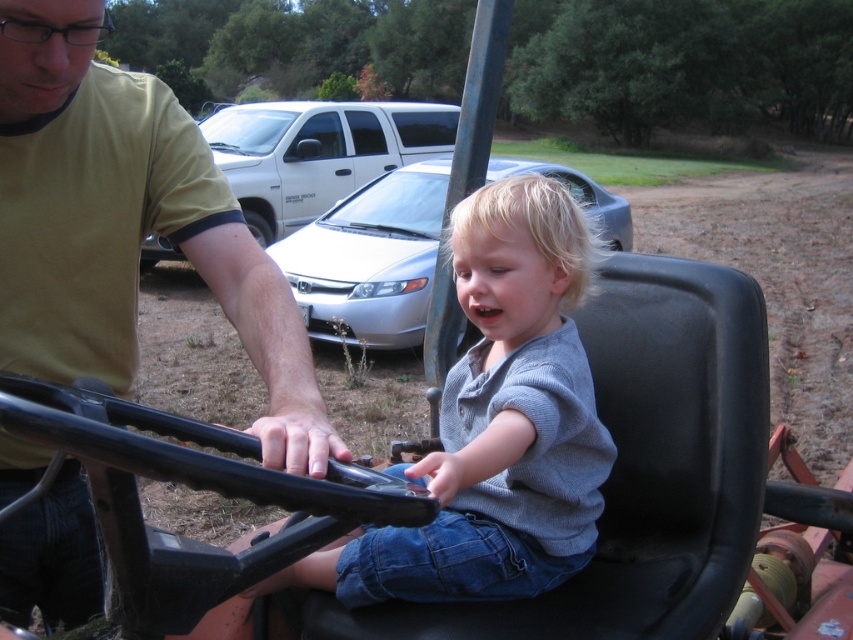
You are a photographer standing behind the tractor and want to take a photo of both the yellow matte shirt at upper left and the gray cotton shirt at center. Which shirt will appear larger in the photo?

The yellow matte shirt at upper left will appear larger in the photo because it is closer to the viewer than the gray cotton shirt at center.

You are a photographer trying to capture a photo of both the satin silver sedan at center and the silver metallic sedan at center. Since you want to focus on the wider car, which one should you point your camera at?

The silver metallic sedan at center is wider than the satin silver sedan at center, so you should point your camera at the silver metallic sedan at center to focus on the wider car.